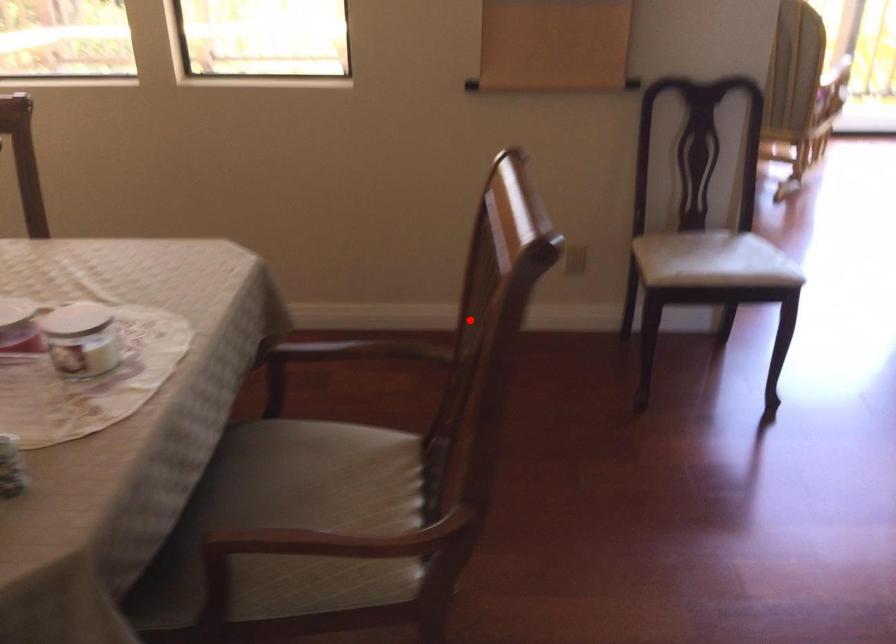
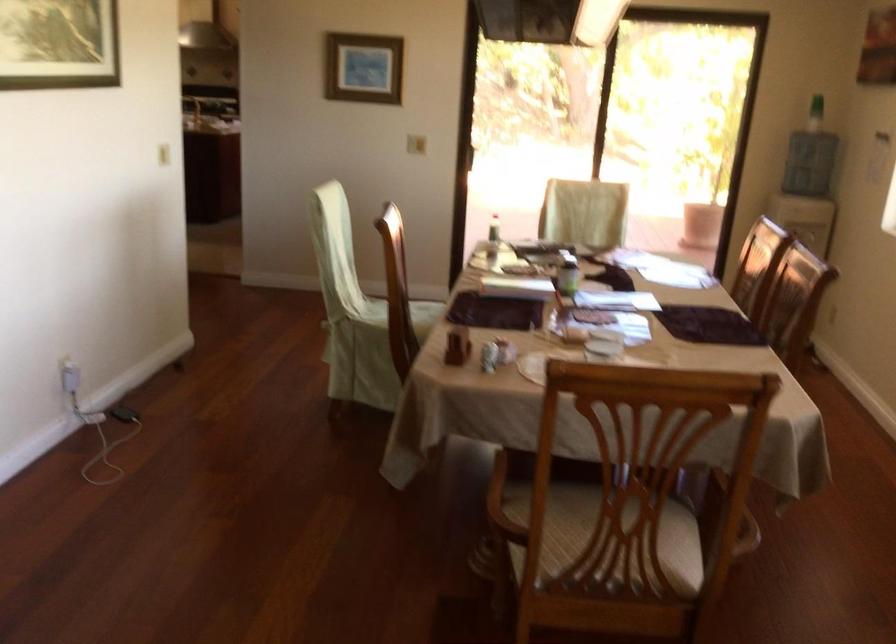
Find the pixel in the second image that matches the highlighted location in the first image.

(722, 509)